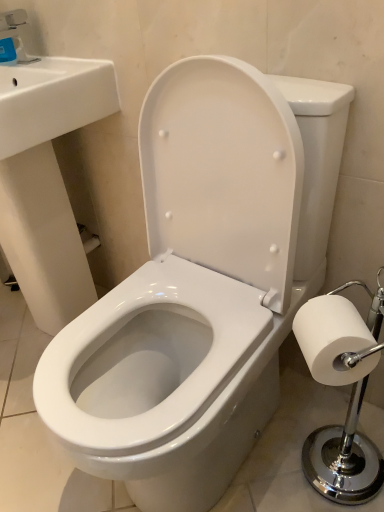
Question: In the image, is white glossy sink at upper left on the left side or the right side of white paper at right?

Choices:
 (A) left
 (B) right

Answer: (A)

Question: Considering the positions of point (23, 224) and point (375, 339), is point (23, 224) closer or farther from the camera than point (375, 339)?

Choices:
 (A) farther
 (B) closer

Answer: (A)

Question: Which of these objects is positioned farthest from the white paper at right?

Choices:
 (A) white glossy sink at upper left
 (B) matte blue plastic faucet at upper left

Answer: (B)

Question: Which of these objects is positioned closest to the matte blue plastic faucet at upper left?

Choices:
 (A) white glossy sink at upper left
 (B) white paper at right

Answer: (A)